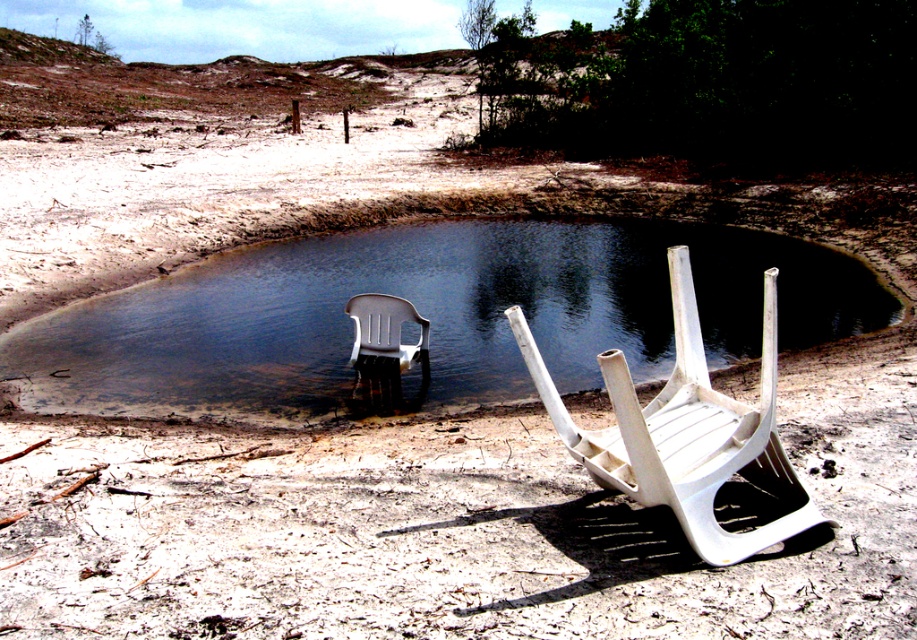
Describe the element at coordinates (450, 528) in the screenshot. I see `white matte sand at lower center` at that location.

Can you confirm if white matte sand at lower center is positioned above white plastic chair at lower right?

Incorrect, white matte sand at lower center is not positioned above white plastic chair at lower right.

This screenshot has height=640, width=917. What do you see at coordinates (450, 528) in the screenshot? I see `white matte sand at lower center` at bounding box center [450, 528].

Where is `white matte sand at lower center`? white matte sand at lower center is located at coordinates (450, 528).

Which is behind, point (109, 476) or point (275, 289)?

The point (275, 289) is behind.

Locate an element on the screen. white matte sand at lower center is located at coordinates (450, 528).

In the scene shown: Between clear water at chair left and white plastic chair at center, which one is positioned lower?

white plastic chair at center

Is clear water at chair left bigger than white plastic chair at center?

Indeed, clear water at chair left has a larger size compared to white plastic chair at center.

This screenshot has width=917, height=640. What do you see at coordinates (429, 314) in the screenshot?
I see `clear water at chair left` at bounding box center [429, 314].

Where is `clear water at chair left`? The image size is (917, 640). clear water at chair left is located at coordinates (429, 314).